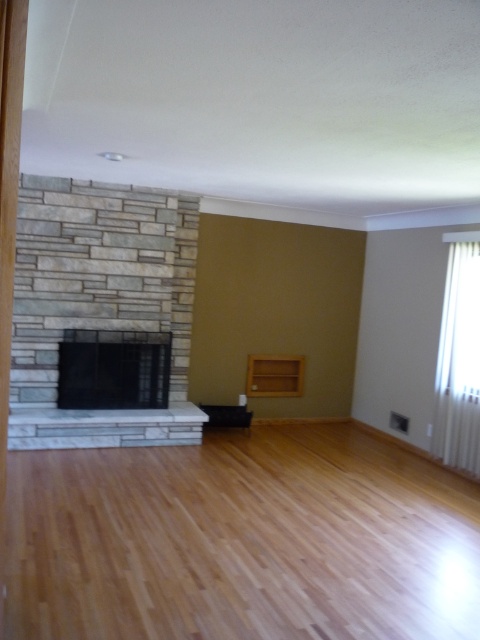
You are standing in the room and want to place a large painting behind both the white marble fireplace at center and the white plastic radiator at right. Is this possible?

The white marble fireplace at center is in front of the white plastic radiator at right, so placing a painting behind both would require positioning it behind the radiator, as the fireplace is already blocking the space behind it.

You are an interior designer assessing the room layout. You need to place a tall floor lamp that requires at least 2 meters of vertical space. Based on the provided scene, which object between the white plastic radiator at right and the light brown wood shelf at center would allow proper placement of the lamp without obstructing its height?

The white plastic radiator at right has a greater height compared to the light brown wood shelf at center. Therefore, placing the tall floor lamp next to the white plastic radiator at right would be more suitable as it provides the necessary vertical space of at least 2 meters without obstruction.

Consider the image. You are moving a 3 feet wide painting and want to hang it above the black glass fireplace at center. The light brown wood shelf at center is in the way. Can the painting fit above the fireplace without overlapping the shelf?

The black glass fireplace at center might be wider than light brown wood shelf at center, so there is a possibility that the painting can fit above the fireplace without overlapping the shelf if the fireplace is indeed wider. However, without exact measurements, it is uncertain.